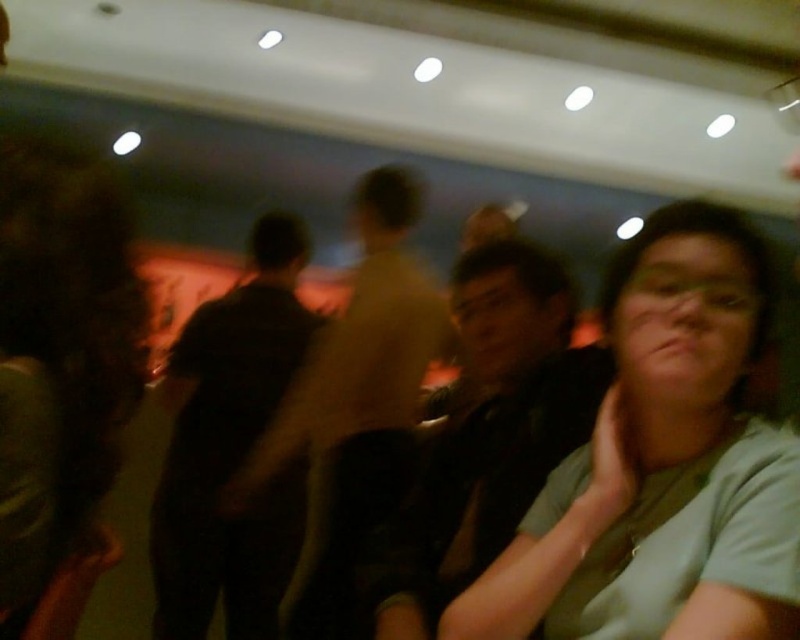
Looking at this image, you are holding a camera and want to take a clearer photo of the light blue fabric at center. Based on its current distance from the camera, should you move closer or farther away to ensure it fills the frame without being too small?

The light blue fabric at center is 26.21 inches away from the camera. To ensure it fills the frame without being too small, you should move closer to the fabric.

You are at a party and want to take a photo of the matte black shirt at center and the white matte hand at lower right. Which object should you focus on to ensure it is less blurry in the photo?

The matte black shirt at center is wider than the white matte hand at lower right, so focusing on the matte black shirt at center would likely result in less blur since it is larger and more stable in the frame.

You are at a party and notice two items in the scene. The first is a matte black shirt at center, and the second is a white matte hand at lower right. Based on their positions, which one is closer to the ceiling?

The matte black shirt at center is much taller than the white matte hand at lower right, so it is closer to the ceiling.